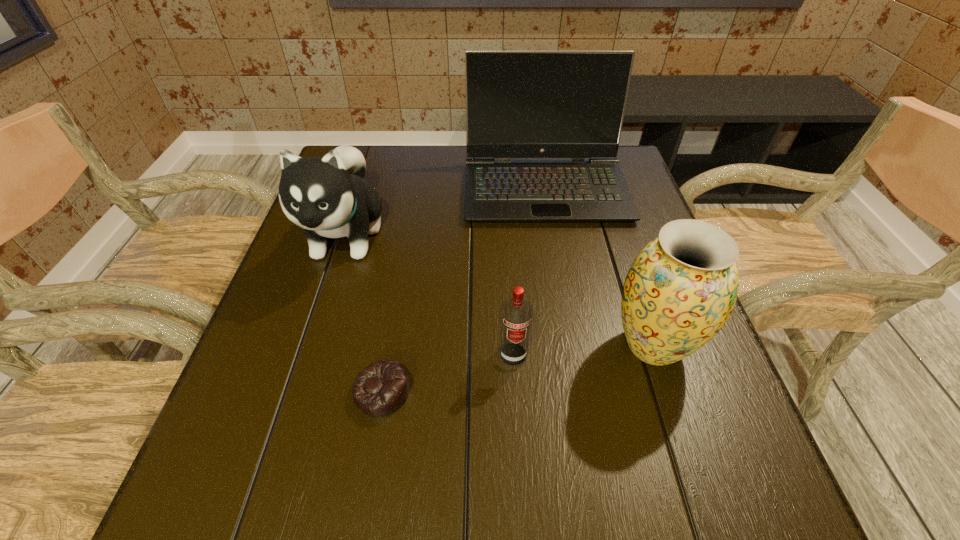
Where is `laptop computer`? This screenshot has width=960, height=540. laptop computer is located at coordinates (519, 104).

You are a GUI agent. You are given a task and a screenshot of the screen. Output one action in this format:
    pyautogui.click(x=<x>, y=<y>)
    Task: Click on the leftmost object
    
    Given the screenshot: What is the action you would take?
    (328, 197)

This screenshot has height=540, width=960. I want to click on vase, so pyautogui.click(x=680, y=290).

You are a GUI agent. You are given a task and a screenshot of the screen. Output one action in this format:
    pyautogui.click(x=<x>, y=<y>)
    Task: Click on the fourth tallest object
    The width and height of the screenshot is (960, 540).
    Given the screenshot: What is the action you would take?
    pyautogui.click(x=516, y=314)

What are the coordinates of `beanbag` in the screenshot? It's located at (380, 389).

You are a GUI agent. You are given a task and a screenshot of the screen. Output one action in this format:
    pyautogui.click(x=<x>, y=<y>)
    Task: Click on the fourth object from right to left
    Image resolution: width=960 pixels, height=540 pixels.
    Given the screenshot: What is the action you would take?
    380,389

I want to click on free space located 0.200m on the screen of the laptop computer, so click(x=562, y=285).

Locate an element on the screen. This screenshot has height=540, width=960. free space located 0.260m at the face of the leftmost object is located at coordinates (294, 396).

Identify the location of vacant region located 0.100m on the back of the vase. (630, 276).

You are a GUI agent. You are given a task and a screenshot of the screen. Output one action in this format:
    pyautogui.click(x=<x>, y=<y>)
    Task: Click on the vacant space situated on the front label of the vodka
    The height and width of the screenshot is (540, 960).
    Given the screenshot: What is the action you would take?
    pyautogui.click(x=516, y=412)